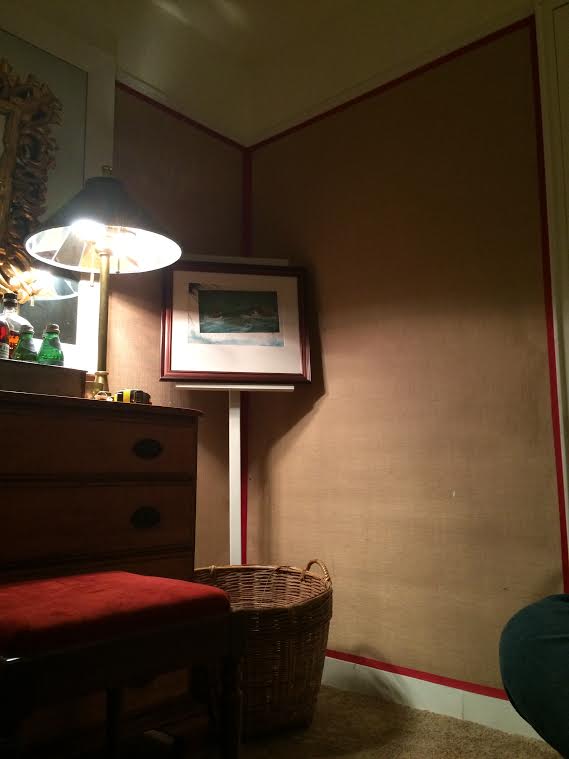
Where is `brown frame`? This screenshot has height=759, width=569. brown frame is located at coordinates (269, 373).